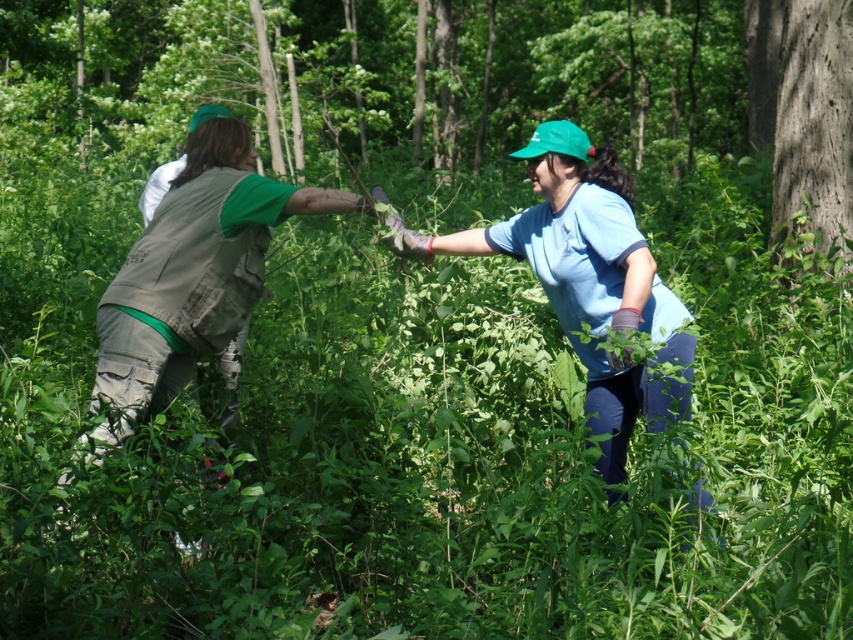
You are a photographer standing in front of the scene. You want to take a photo that includes both the blue cotton shirt at center and the smooth brown bark at right. Which object should you focus on first to ensure both are in sharp focus?

The blue cotton shirt at center is closer to the viewer than the smooth brown bark at right. To ensure both are in sharp focus, you should focus on the blue cotton shirt at center first, as it is closer, and the smooth brown bark at right will naturally be within the depth of field if focused properly on the closer object.

Based on the scene described, if you were to compare the height of the green fabric vest at center and the smooth brown bark at right, which one is taller?

The smooth brown bark at right is taller than the green fabric vest at center.

You are standing at the origin point of the image. A point is marked at coordinates (584,280). What object is this point located on?

The point at coordinates (584,280) is located on the green fabric vest at center.